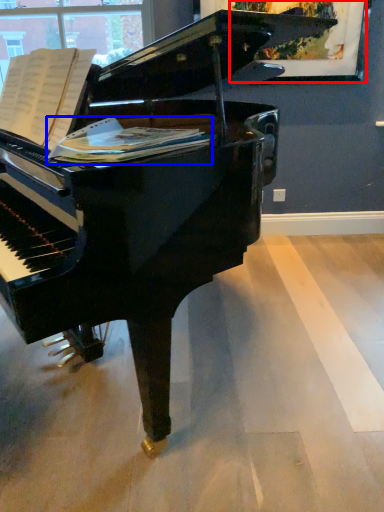
Question: Which object appears closest to the camera in this image, picture frame (highlighted by a red box) or sheet music (highlighted by a blue box)?

Choices:
 (A) picture frame
 (B) sheet music

Answer: (B)